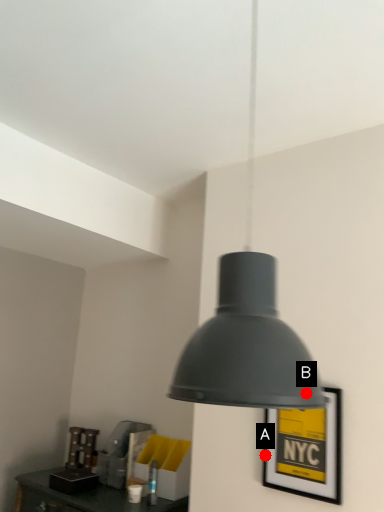
Question: Two points are circled on the image, labeled by A and B beside each circle. Which point is closer to the camera?

Choices:
 (A) A is closer
 (B) B is closer

Answer: (B)